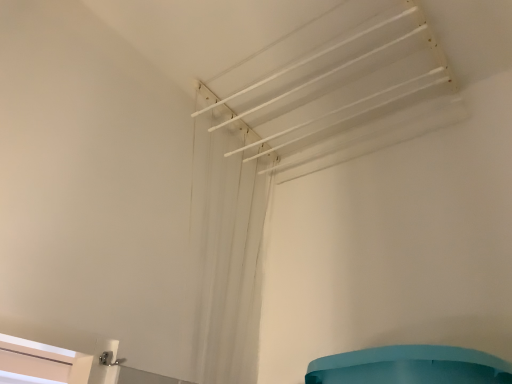
I want to click on white matte curtain at upper center, so click(312, 127).

What do you see at coordinates (312, 127) in the screenshot?
I see `white matte curtain at upper center` at bounding box center [312, 127].

Identify the location of white matte curtain at upper center. (312, 127).